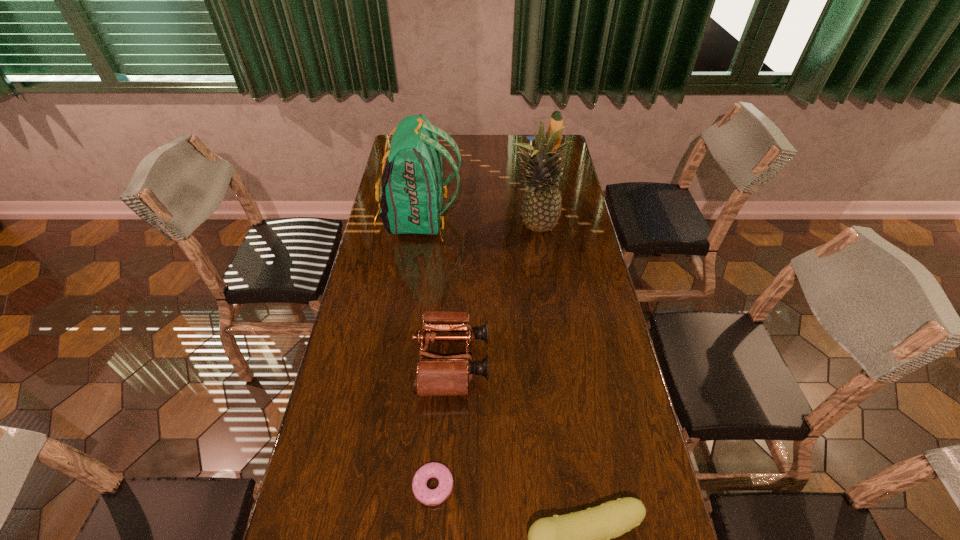
Where is `vacant area situated 0.130m on the label of the fourth shortest object`? vacant area situated 0.130m on the label of the fourth shortest object is located at coordinates (512, 177).

Find the location of a particular element. This screenshot has width=960, height=540. free space located 0.230m on the label of the fourth shortest object is located at coordinates (489, 177).

The width and height of the screenshot is (960, 540). In order to click on vacant space located 0.260m through the eyepieces of the binoculars in this screenshot , I will do `click(578, 361)`.

Identify the location of free point located 0.120m on the left of the doughnut. The width and height of the screenshot is (960, 540). (362, 486).

At what (x,y) coordinates should I click in order to perform the action: click on object at the left edge. Please return your answer as a coordinate pair (x, y). This screenshot has height=540, width=960. Looking at the image, I should click on (412, 189).

At what (x,y) coordinates should I click in order to perform the action: click on pineapple present at the right edge. Please return your answer as a coordinate pair (x, y). The image size is (960, 540). Looking at the image, I should click on (541, 207).

Image resolution: width=960 pixels, height=540 pixels. I want to click on detergent at the right edge, so click(x=556, y=119).

Image resolution: width=960 pixels, height=540 pixels. Identify the location of free region at the far edge. (511, 146).

In the image, there is a desktop. At what (x,y) coordinates should I click in order to perform the action: click on vacant region at the left edge. Please return your answer as a coordinate pair (x, y). The width and height of the screenshot is (960, 540). Looking at the image, I should click on (383, 319).

The image size is (960, 540). Find the location of `free space at the right edge of the desktop`. free space at the right edge of the desktop is located at coordinates (563, 238).